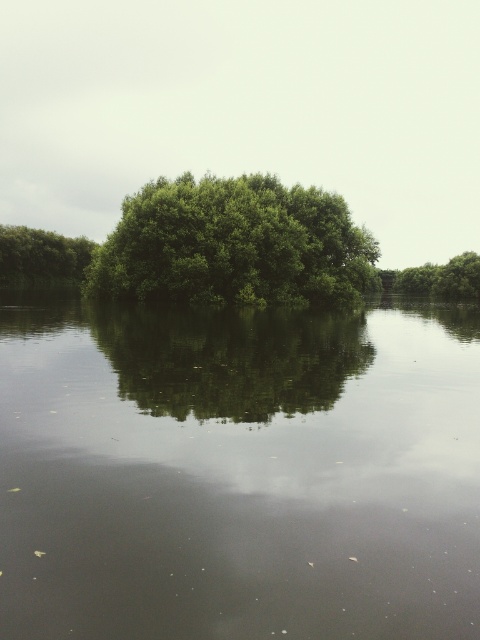
Question: Which point is closer to the camera?

Choices:
 (A) green reflective water at center
 (B) green leafy tree at upper right
 (C) green leafy tree at left
 (D) green leafy tree at center

Answer: (A)

Question: Which of the following is the closest to the observer?

Choices:
 (A) (314, 272)
 (B) (11, 228)

Answer: (A)

Question: Considering the real-world distances, which object is closest to the green leafy tree at center?

Choices:
 (A) green reflective water at center
 (B) green leafy tree at upper right

Answer: (A)

Question: From the image, what is the correct spatial relationship of green leafy tree at center in relation to green leafy tree at left?

Choices:
 (A) above
 (B) below

Answer: (B)

Question: Can you confirm if green reflective water at center is positioned to the right of green leafy tree at center?

Choices:
 (A) no
 (B) yes

Answer: (A)

Question: Where is green reflective water at center located in relation to green leafy tree at left in the image?

Choices:
 (A) above
 (B) below

Answer: (B)